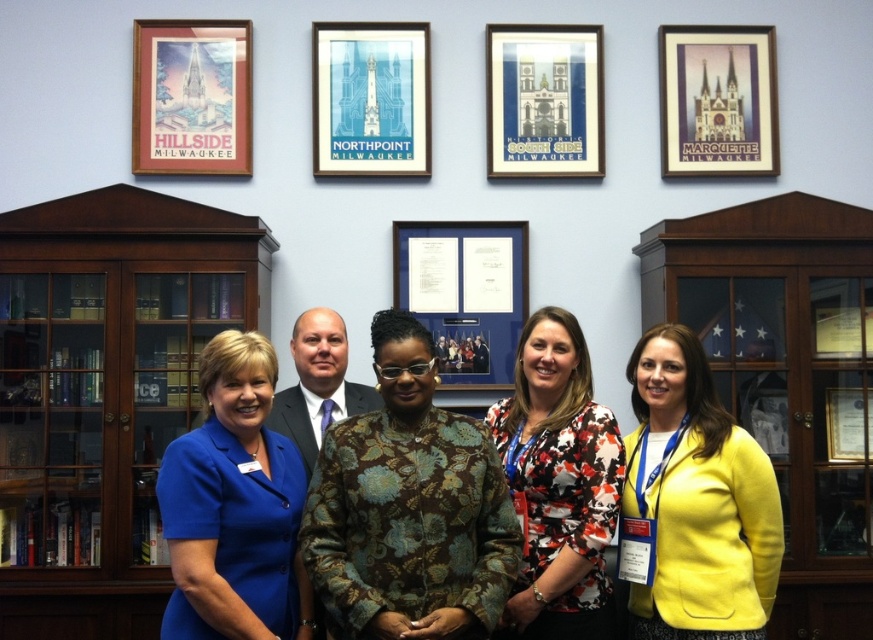
Does point (607, 600) come in front of point (485, 244)?

Yes, it is.

Between floral print blouse at center and blue glass picture frame at center, which one has more height?

Result: Standing taller between the two is floral print blouse at center.

At what (x,y) coordinates should I click in order to perform the action: click on floral print blouse at center. Please return your answer as a coordinate pair (x, y). This screenshot has height=640, width=873. Looking at the image, I should click on (558, 483).

Does brown wood bookshelf at left appear over matte black suit at center?

No.

This screenshot has width=873, height=640. Describe the element at coordinates (105, 392) in the screenshot. I see `brown wood bookshelf at left` at that location.

Is point (40, 234) closer to viewer compared to point (324, 419)?

No, (40, 234) is behind (324, 419).

The height and width of the screenshot is (640, 873). I want to click on brown wood bookshelf at left, so click(x=105, y=392).

Who is higher up, yellow fabric jacket at lower right or blue paper picture frame at center?

blue paper picture frame at center

Can you confirm if yellow fabric jacket at lower right is positioned to the right of blue paper picture frame at center?

Indeed, yellow fabric jacket at lower right is positioned on the right side of blue paper picture frame at center.

What do you see at coordinates (693, 502) in the screenshot? I see `yellow fabric jacket at lower right` at bounding box center [693, 502].

Locate an element on the screen. yellow fabric jacket at lower right is located at coordinates (693, 502).